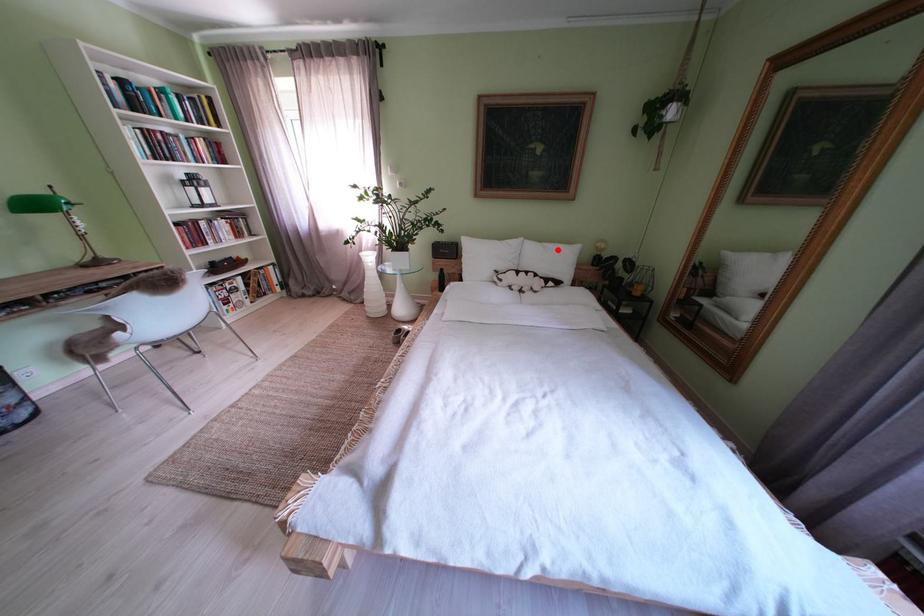
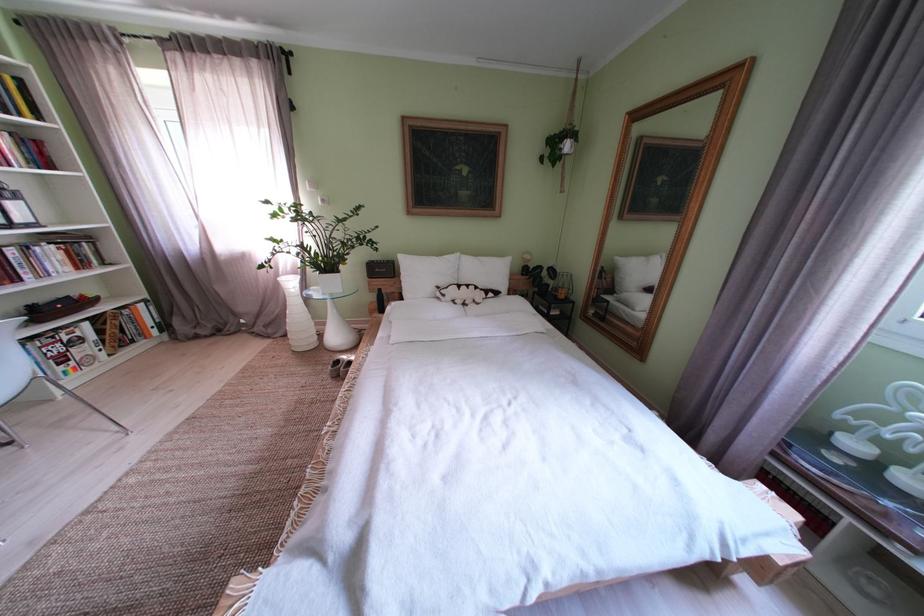
Find the pixel in the second image that matches the highlighted location in the first image.

(492, 264)